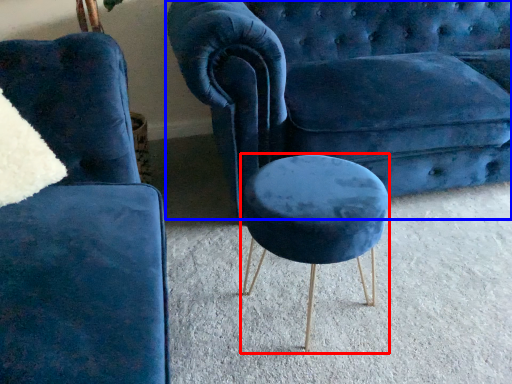
Question: Which of the following is the farthest to the observer, stool (highlighted by a red box) or studio couch (highlighted by a blue box)?

Choices:
 (A) stool
 (B) studio couch

Answer: (B)